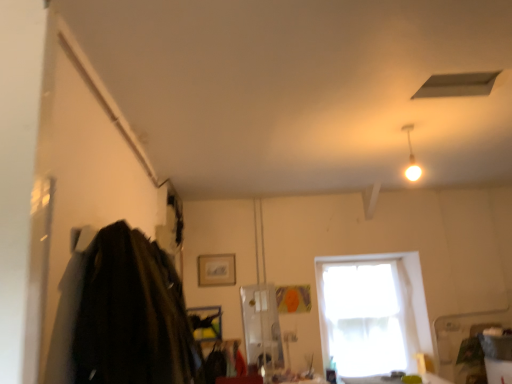
Measure the distance between point (88, 295) and camera.

A distance of 5.28 feet exists between point (88, 295) and camera.

Image resolution: width=512 pixels, height=384 pixels. I want to click on matte white exhaust hood at upper center, so click(457, 85).

The image size is (512, 384). Describe the element at coordinates (411, 158) in the screenshot. I see `white glossy light fixture at upper right` at that location.

Locate an element on the screen. dark wool coat at left is located at coordinates (133, 315).

In the scene shown: Is matte white exhaust hood at upper center not within white glossy light fixture at upper right?

Yes.

Based on their positions, is matte white exhaust hood at upper center located to the left or right of white glossy light fixture at upper right?

In the image, matte white exhaust hood at upper center appears on the right side of white glossy light fixture at upper right.

Does point (480, 78) come in front of point (411, 160)?

Yes, point (480, 78) is in front of point (411, 160).

Relative to white glossy light fixture at upper right, is matte white exhaust hood at upper center in front or behind?

Visually, matte white exhaust hood at upper center is located in front of white glossy light fixture at upper right.

Is dark wool coat at left wider than white sheer curtain at center?

Indeed, dark wool coat at left has a greater width compared to white sheer curtain at center.

This screenshot has width=512, height=384. Find the location of `window beneath the dark wool coat at left (from a real-world perspective)`. window beneath the dark wool coat at left (from a real-world perspective) is located at coordinates (376, 298).

In the scene shown: From a real-world perspective, who is located lower, dark wool coat at left or white sheer curtain at center?

In real-world perspective, white sheer curtain at center is lower.

In the scene shown: Considering the positions of objects dark wool coat at left and white sheer curtain at center in the image provided, who is more to the right, dark wool coat at left or white sheer curtain at center?

Positioned to the right is white sheer curtain at center.

Who is smaller, white sheer curtain at center or dark wool coat at left?

dark wool coat at left is smaller.

From a real-world perspective, which object stands above the other?

From a 3D spatial view, dark wool coat at left is above.

Can dark wool coat at left be found inside white sheer curtain at center?

That's incorrect, dark wool coat at left is not inside white sheer curtain at center.

Is white sheer curtain at center wider than dark wool coat at left?

No.

Which of these two, white sheer curtain at center or matte white exhaust hood at upper center, stands taller?

With more height is white sheer curtain at center.

Is white sheer curtain at center at the right side of matte white exhaust hood at upper center?

Yes.

How far apart are white sheer curtain at center and matte white exhaust hood at upper center?

A distance of 2.89 meters exists between white sheer curtain at center and matte white exhaust hood at upper center.

Can you tell me how much white sheer curtain at center and matte white exhaust hood at upper center differ in facing direction?

white sheer curtain at center and matte white exhaust hood at upper center are facing 0.00257 degrees away from each other.

Is matte white exhaust hood at upper center inside or outside of white sheer curtain at center?

matte white exhaust hood at upper center cannot be found inside white sheer curtain at center.

From the image's perspective, is matte white exhaust hood at upper center above white sheer curtain at center?

Indeed, from the image's perspective, matte white exhaust hood at upper center is shown above white sheer curtain at center.

Would you say matte white exhaust hood at upper center is a long distance from white sheer curtain at center?

That's right, there is a large distance between matte white exhaust hood at upper center and white sheer curtain at center.

Does point (461, 90) come farther from viewer compared to point (330, 297)?

That is False.

Which is more to the right, white glossy light fixture at upper right or matte white exhaust hood at upper center?

From the viewer's perspective, matte white exhaust hood at upper center appears more on the right side.

Can you see white glossy light fixture at upper right touching matte white exhaust hood at upper center?

No, white glossy light fixture at upper right is not next to matte white exhaust hood at upper center.

The image size is (512, 384). I want to click on light fixture below the matte white exhaust hood at upper center (from a real-world perspective), so click(411, 158).

Would you say matte white exhaust hood at upper center is part of white glossy light fixture at upper right's contents?

No.

From a real-world perspective, is white glossy light fixture at upper right positioned above or below white sheer curtain at center?

Clearly, from a real-world perspective, white glossy light fixture at upper right is above white sheer curtain at center.

Is white glossy light fixture at upper right not close to white sheer curtain at center?

white glossy light fixture at upper right is positioned a significant distance from white sheer curtain at center.

The height and width of the screenshot is (384, 512). I want to click on exhaust hood in front of the white glossy light fixture at upper right, so click(457, 85).

Identify the location of window below the dark wool coat at left (from a real-world perspective). The image size is (512, 384). (376, 298).

Looking at the image, which one is located closer to dark wool coat at left, white sheer curtain at center or white glossy light fixture at upper right?

white glossy light fixture at upper right lies closer to dark wool coat at left than the other object.

From the image, which object appears to be nearer to white sheer curtain at center, dark wool coat at left or matte white exhaust hood at upper center?

dark wool coat at left is closer to white sheer curtain at center.

From the image, which object appears to be nearer to white sheer curtain at center, white glossy light fixture at upper right or dark wool coat at left?

Among the two, white glossy light fixture at upper right is located nearer to white sheer curtain at center.

From the image, which object appears to be farther from white glossy light fixture at upper right, matte white exhaust hood at upper center or white sheer curtain at center?

Based on the image, white sheer curtain at center appears to be further to white glossy light fixture at upper right.

When comparing their distances from white glossy light fixture at upper right, does white sheer curtain at center or dark wool coat at left seem further?

The object further to white glossy light fixture at upper right is dark wool coat at left.

Based on their spatial positions, is white sheer curtain at center or matte white exhaust hood at upper center further from white glossy light fixture at upper right?

white sheer curtain at center.

Looking at the image, which one is located further to dark wool coat at left, white glossy light fixture at upper right or matte white exhaust hood at upper center?

Based on the image, white glossy light fixture at upper right appears to be further to dark wool coat at left.

Estimate the real-world distances between objects in this image. Which object is further from dark wool coat at left, matte white exhaust hood at upper center or white sheer curtain at center?

Among the two, white sheer curtain at center is located further to dark wool coat at left.

Identify the location of light fixture between dark wool coat at left and matte white exhaust hood at upper center from left to right. The width and height of the screenshot is (512, 384). (411, 158).

Locate an element on the screen. This screenshot has width=512, height=384. exhaust hood located between dark wool coat at left and white sheer curtain at center in the depth direction is located at coordinates (457, 85).

Locate an element on the screen. light fixture between matte white exhaust hood at upper center and white sheer curtain at center from front to back is located at coordinates (411, 158).

Find the location of a particular element. This screenshot has width=512, height=384. light fixture between dark wool coat at left and white sheer curtain at center in the front-back direction is located at coordinates (411, 158).